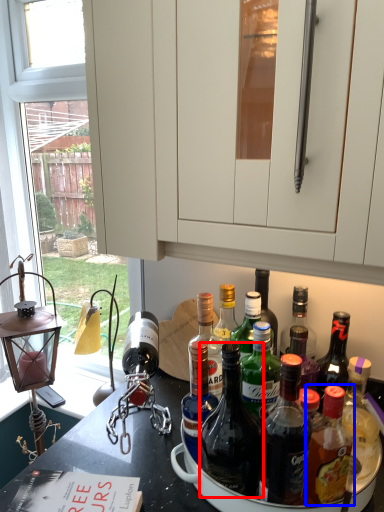
Question: Which of the following is the closest to the observer, bottle (highlighted by a red box) or bottle (highlighted by a blue box)?

Choices:
 (A) bottle
 (B) bottle

Answer: (B)